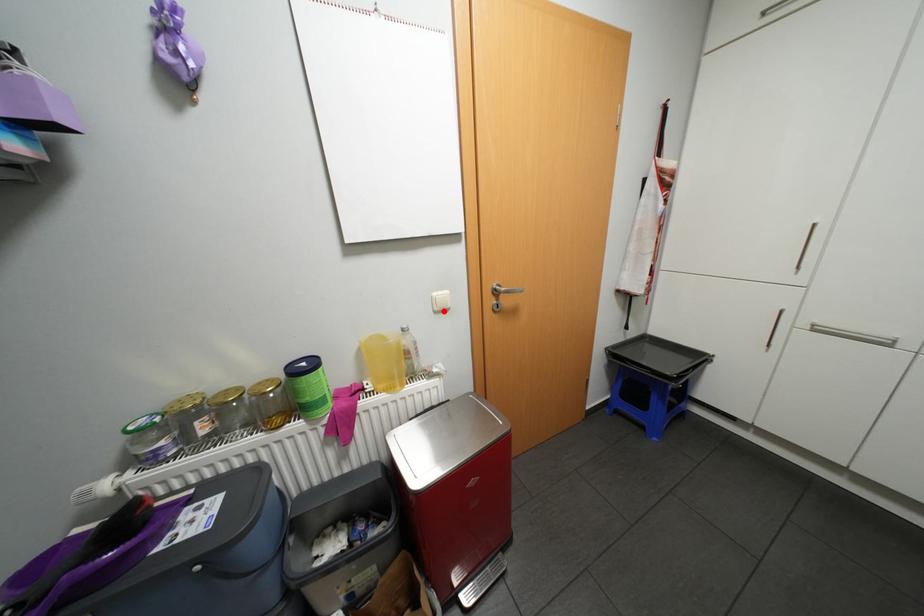
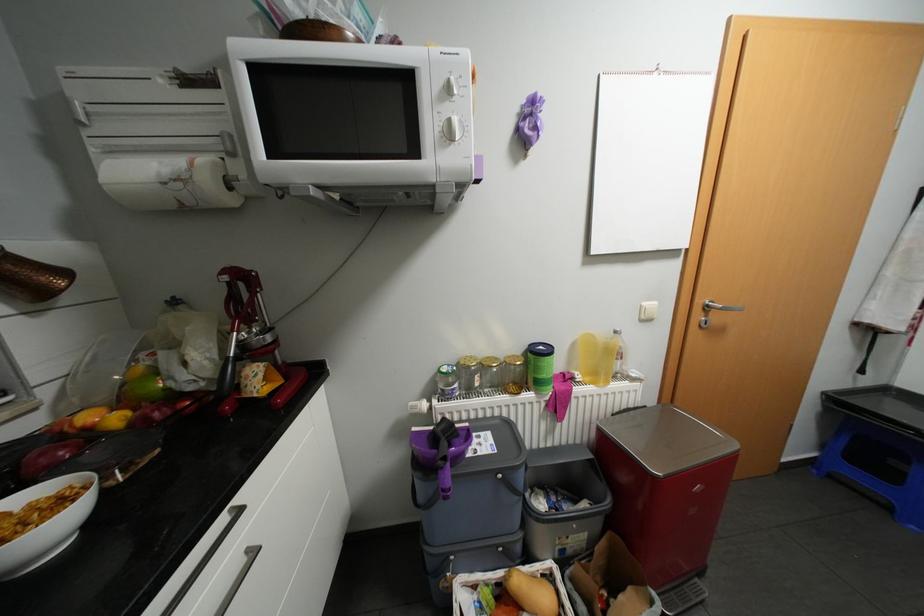
In the second image, find the point that corresponds to the highlighted location in the first image.

(649, 320)